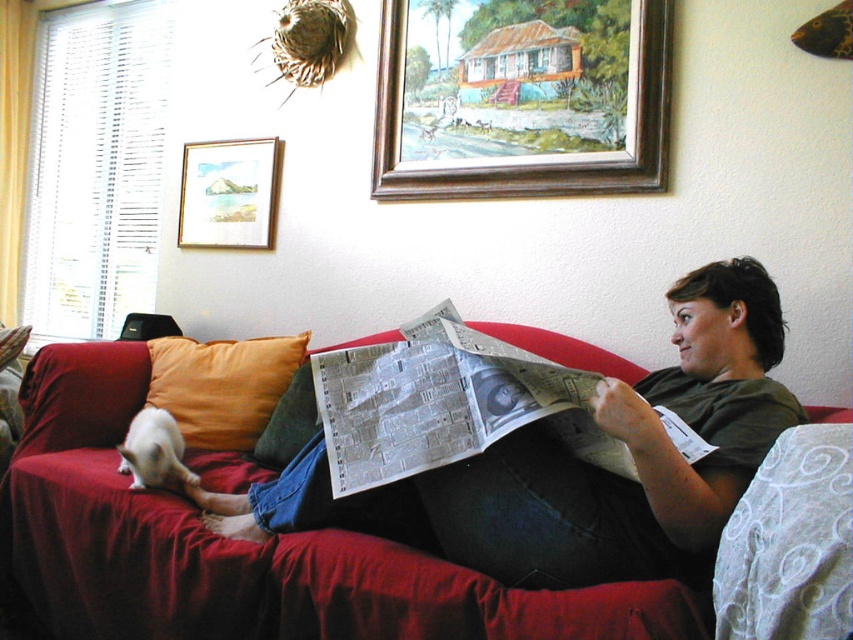
Does wooden picture frame at upper center appear on the left side of white glossy newspaper at center?

No, wooden picture frame at upper center is not to the left of white glossy newspaper at center.

Between wooden picture frame at upper center and white glossy newspaper at center, which one is positioned lower?

white glossy newspaper at center is below.

Who is more forward, (660,45) or (463,445)?

Point (463,445) is in front.

Where is `wooden picture frame at upper center`? This screenshot has width=853, height=640. wooden picture frame at upper center is located at coordinates tap(521, 97).

Which is in front, point (212, 160) or point (288, 445)?

Point (288, 445)

Who is more distant from viewer, (196,243) or (316,422)?

Positioned behind is point (196,243).

At what (x,y) coordinates should I click in order to perform the action: click on gold-framed picture at upper left. Please return your answer as a coordinate pair (x, y). The width and height of the screenshot is (853, 640). Looking at the image, I should click on (229, 193).

Who is more forward, (646, 22) or (263, 205)?

Point (646, 22) is more forward.

Does wooden picture frame at upper center have a greater height compared to gold-framed picture at upper left?

Indeed, wooden picture frame at upper center has a greater height compared to gold-framed picture at upper left.

Which is behind, point (587, 147) or point (247, 236)?

The point (247, 236) is behind.

Where is `wooden picture frame at upper center`? The width and height of the screenshot is (853, 640). wooden picture frame at upper center is located at coordinates (521, 97).